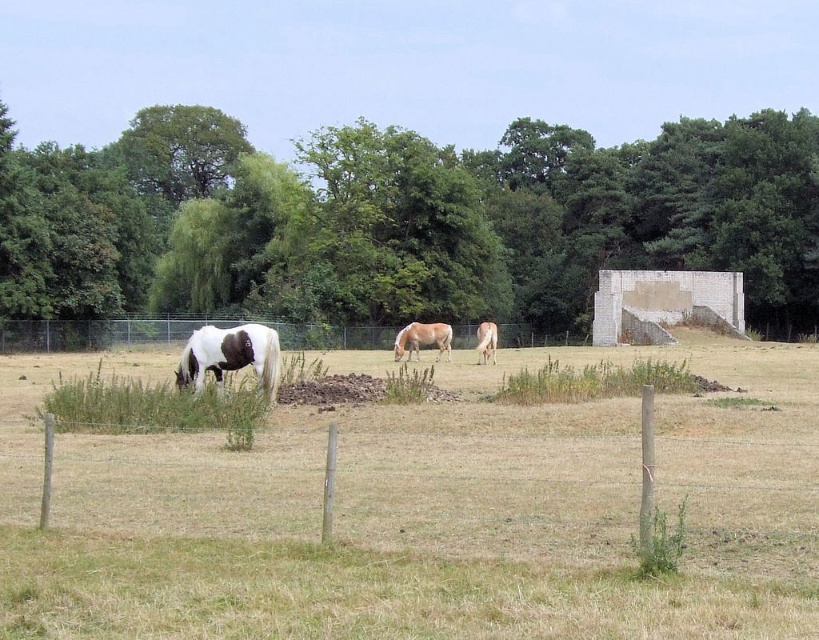
Question: Can you confirm if white and brown speckled horse at left is thinner than white glossy horse at center?

Choices:
 (A) yes
 (B) no

Answer: (B)

Question: Estimate the real-world distances between objects in this image. Which object is farther from the white and brown speckled horse at left?

Choices:
 (A) green leafy tree at upper center
 (B) light brown horse at center

Answer: (A)

Question: Is the position of white and brown speckled horse at left less distant than that of white glossy horse at center?

Choices:
 (A) yes
 (B) no

Answer: (A)

Question: Does green leafy tree at upper center have a larger size compared to light brown horse at center?

Choices:
 (A) yes
 (B) no

Answer: (A)

Question: Based on their relative distances, which object is nearer to the green leafy tree at upper center?

Choices:
 (A) light brown horse at center
 (B) white and brown speckled horse at left
 (C) white glossy horse at center

Answer: (A)

Question: Which point is closer to the camera taking this photo?

Choices:
 (A) (492, 342)
 (B) (179, 368)

Answer: (B)